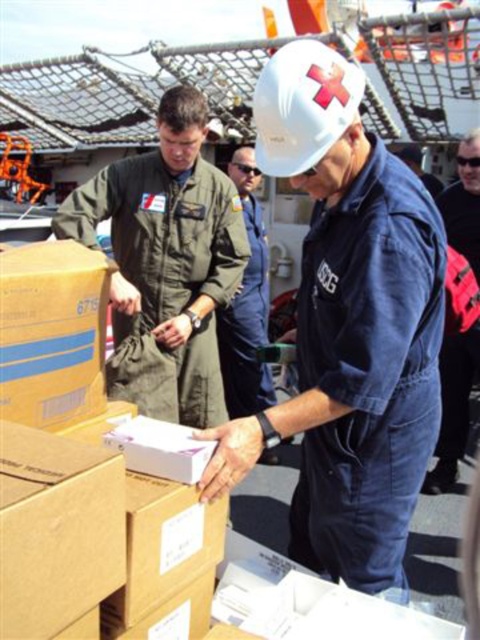
Does yellow cardboard box at lower left have a smaller size compared to denim jacket at lower right?

Yes.

Is point (11, 387) positioned behind point (466, 140)?

No, it is in front of (466, 140).

What are the coordinates of `yellow cardboard box at lower left` in the screenshot? It's located at (51, 333).

Describe the element at coordinates (348, 326) in the screenshot. I see `white hard hat at center` at that location.

Does white hard hat at center have a smaller size compared to blue denim jumpsuit at center?

Incorrect, white hard hat at center is not smaller in size than blue denim jumpsuit at center.

Is point (328, 202) closer to camera compared to point (247, 314)?

Yes, it is.

You are a GUI agent. You are given a task and a screenshot of the screen. Output one action in this format:
    pyautogui.click(x=<x>, y=<y>)
    Task: Click on the white hard hat at center
    
    Given the screenshot: What is the action you would take?
    pyautogui.click(x=348, y=326)

Between point (181, 310) and point (38, 488), which one is positioned behind?

The point (181, 310) is more distant.

Who is more forward, (204, 285) or (120, 541)?

Point (120, 541) is more forward.

Describe the element at coordinates (168, 248) in the screenshot. I see `green fabric uniform at center` at that location.

Find the location of a particular element. Image resolution: width=480 pixels, height=640 pixels. green fabric uniform at center is located at coordinates (168, 248).